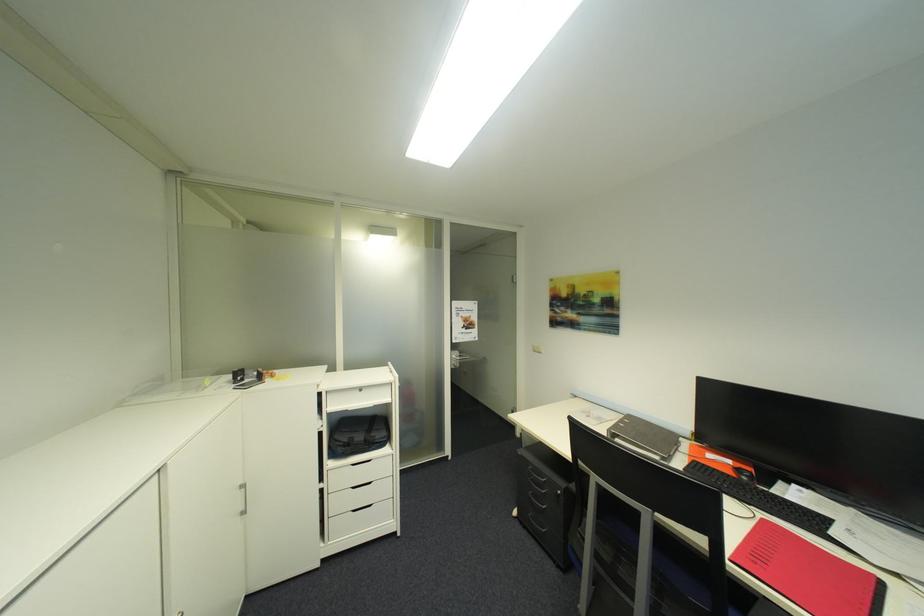
Which object does [643,437] point to?

It corresponds to the closed grey laptop in the image.